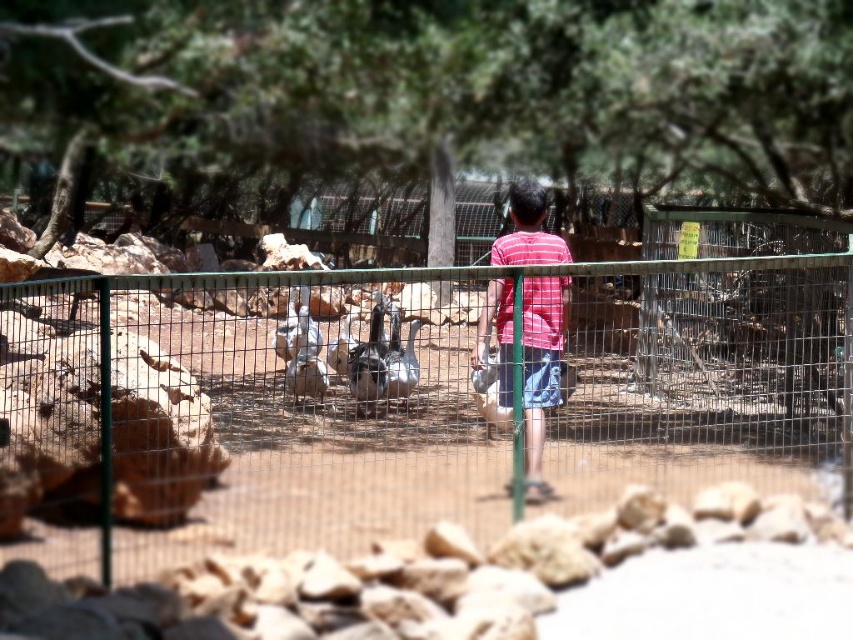
Who is positioned more to the left, green wire mesh fence at center or striped cotton shirt at center?

From the viewer's perspective, green wire mesh fence at center appears more on the left side.

Does point (4, 557) lie in front of point (527, 243)?

Yes, point (4, 557) is in front of point (527, 243).

Which is in front, point (253, 490) or point (537, 385)?

Point (253, 490) is in front.

Locate an element on the screen. Image resolution: width=853 pixels, height=640 pixels. green wire mesh fence at center is located at coordinates (403, 404).